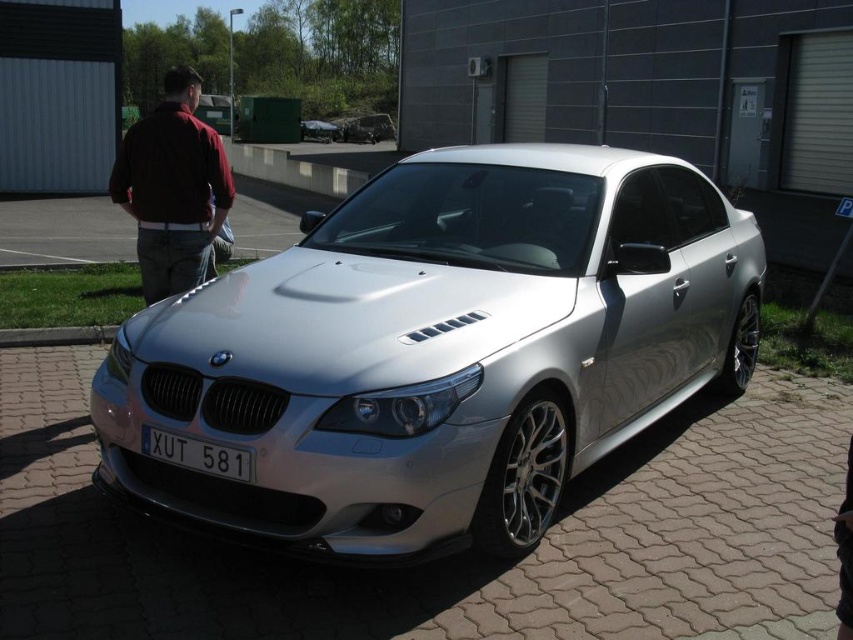
Can you confirm if white plastic license plate at center is thinner than silver metallic car at center?

Indeed, white plastic license plate at center has a lesser width compared to silver metallic car at center.

Who is shorter, white plastic license plate at center or silver metallic car at center?

white plastic license plate at center is shorter.

Identify the location of white plastic license plate at center. (196, 454).

Where is `white plastic license plate at center`? The width and height of the screenshot is (853, 640). white plastic license plate at center is located at coordinates (196, 454).

Does satin silver car at center appear under white plastic license plate at center?

Incorrect, satin silver car at center is not positioned below white plastic license plate at center.

Is satin silver car at center closer to camera compared to white plastic license plate at center?

Yes, it is in front of white plastic license plate at center.

Where is `satin silver car at center`? This screenshot has width=853, height=640. satin silver car at center is located at coordinates (439, 349).

Can you confirm if satin silver car at center is shorter than silver metallic car at center?

Indeed, satin silver car at center has a lesser height compared to silver metallic car at center.

Can you confirm if satin silver car at center is thinner than silver metallic car at center?

No.

In order to click on satin silver car at center in this screenshot , I will do (439, 349).